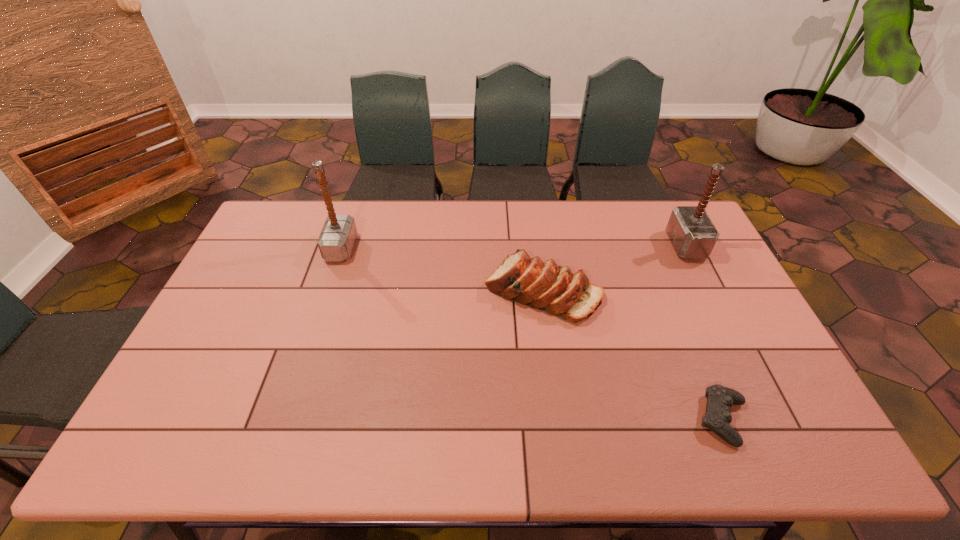
This screenshot has height=540, width=960. Identify the location of object at the near edge. (720, 399).

At what (x,y) coordinates should I click in order to perform the action: click on hammer at the right edge. Please return your answer as a coordinate pair (x, y). The height and width of the screenshot is (540, 960). Looking at the image, I should click on (693, 235).

I want to click on control that is at the right edge, so 720,399.

I want to click on object that is at the far right corner, so click(x=693, y=235).

Identify the location of object situated at the near right corner. (720, 399).

Where is `vacant space at the far edge of the desktop`? This screenshot has width=960, height=540. vacant space at the far edge of the desktop is located at coordinates (459, 237).

What are the coordinates of `vacant region at the left edge of the desktop` in the screenshot? It's located at pyautogui.click(x=267, y=244).

Identify the location of vacant region at the right edge. (718, 263).

At what (x,y) coordinates should I click in order to perform the action: click on empty space that is in between the left hammer and the right hammer. Please return your answer as a coordinate pair (x, y). Image resolution: width=960 pixels, height=540 pixels. Looking at the image, I should click on (514, 247).

Identify the location of vacant area that lies between the right hammer and the shortest object. The height and width of the screenshot is (540, 960). (704, 333).